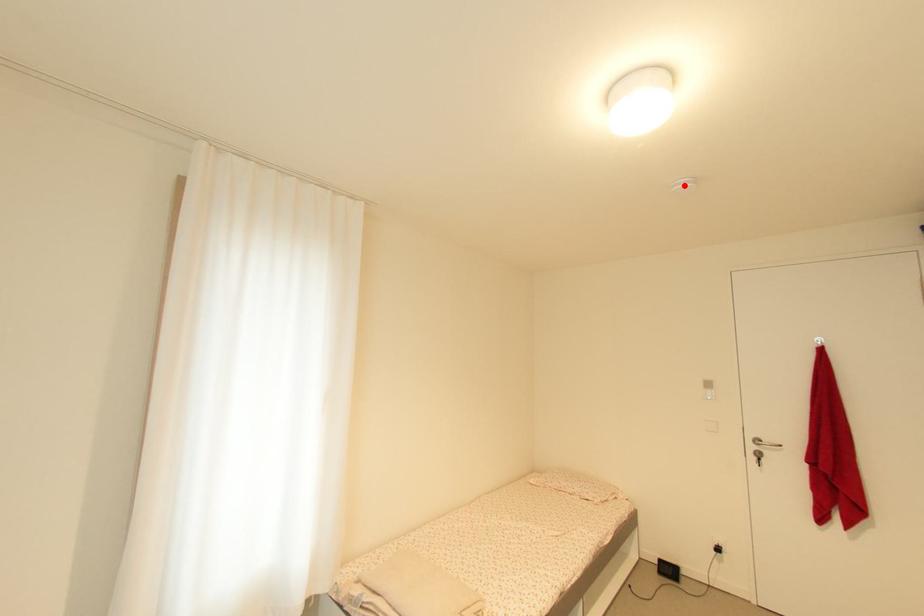
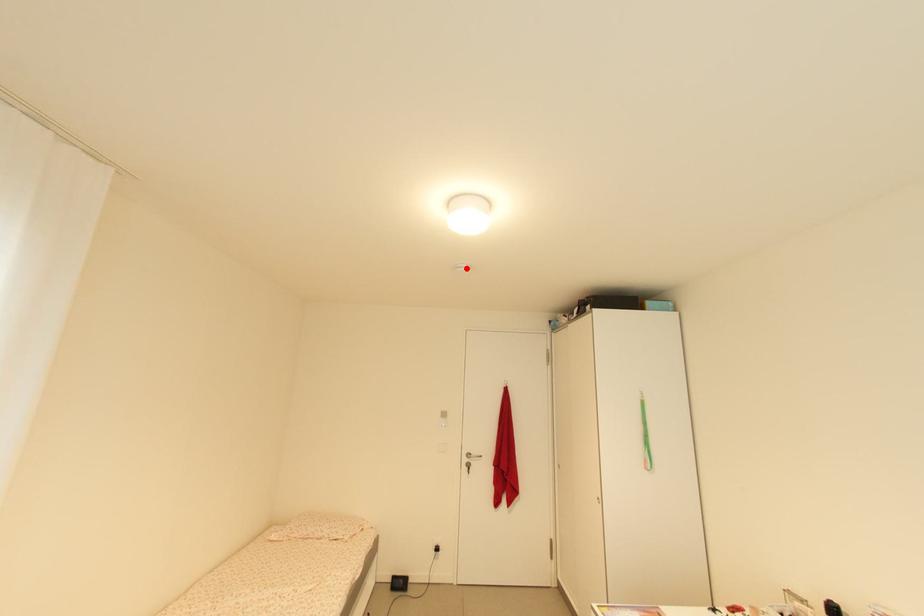
I am providing you with two images of the same scene from different viewpoints. A red point is marked on the first image and another point is marked on the second image. Does the point marked in image1 correspond to the same location as the one in image2?

Yes